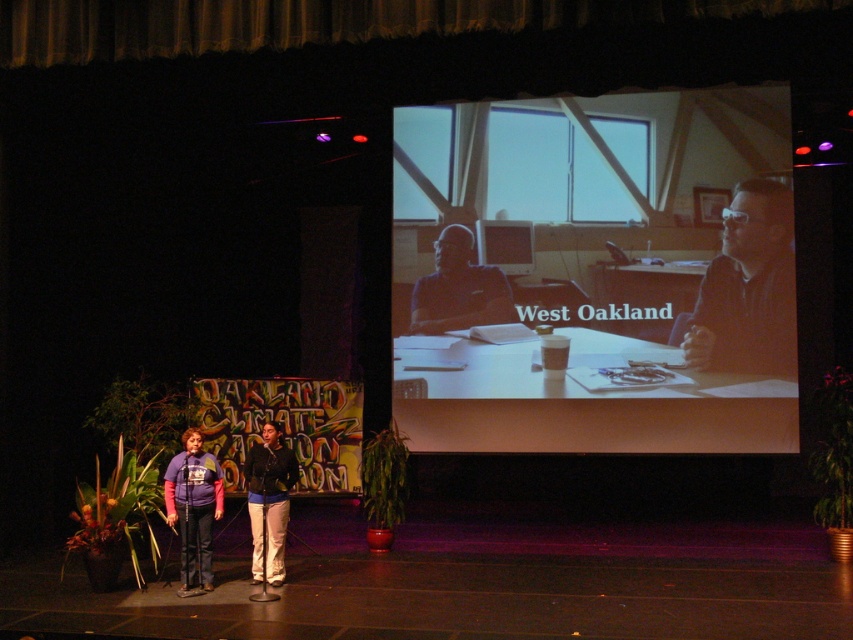
Who is higher up, matte black glasses at upper right or matte black shirt at center?

matte black glasses at upper right is above.

The width and height of the screenshot is (853, 640). What are the coordinates of `matte black glasses at upper right` in the screenshot? It's located at (747, 289).

Can you confirm if velvet gold curtain at upper center is positioned above purple fleece jacket at center?

Indeed, velvet gold curtain at upper center is positioned over purple fleece jacket at center.

Can you confirm if velvet gold curtain at upper center is taller than purple fleece jacket at center?

No, velvet gold curtain at upper center is not taller than purple fleece jacket at center.

The width and height of the screenshot is (853, 640). I want to click on velvet gold curtain at upper center, so click(x=312, y=22).

At what (x,y) coordinates should I click in order to perform the action: click on velvet gold curtain at upper center. Please return your answer as a coordinate pair (x, y). Looking at the image, I should click on (312, 22).

Between matte white board at upper center and velvet gold curtain at upper center, which one has less height?

velvet gold curtain at upper center is shorter.

The image size is (853, 640). What do you see at coordinates (599, 273) in the screenshot?
I see `matte white board at upper center` at bounding box center [599, 273].

The image size is (853, 640). What are the coordinates of `matte white board at upper center` in the screenshot? It's located at (599, 273).